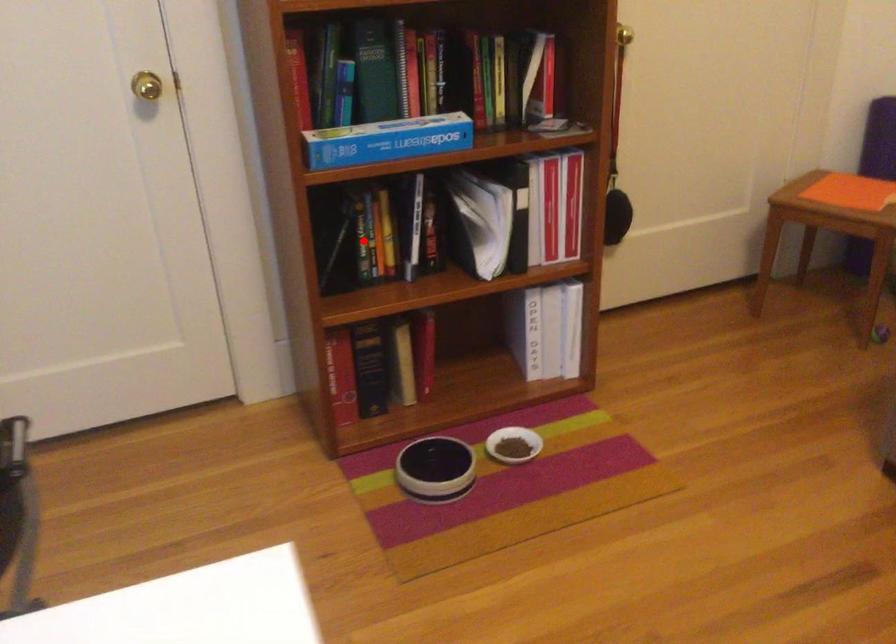
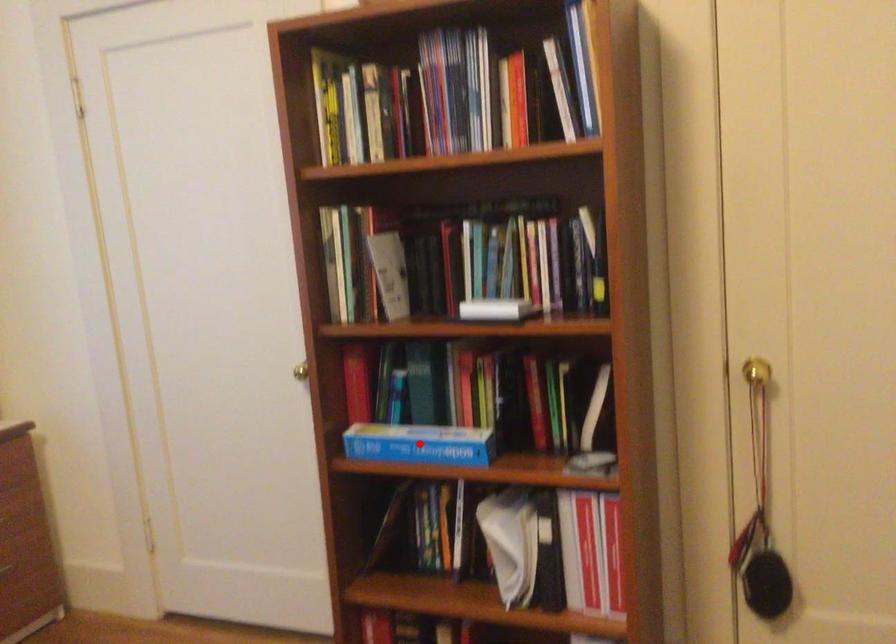
I am providing you with two images of the same scene from different viewpoints. A red point is marked on the first image and another point is marked on the second image. Are the points marked in image1 and image2 representing the same 3D position?

No